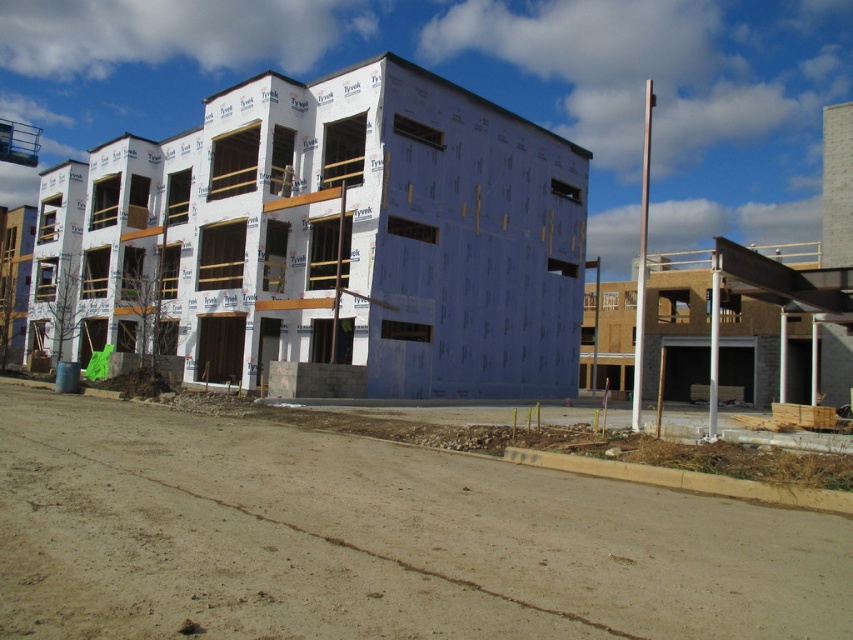
Question: Where is brown dirt track at lower center located in relation to white/textured siding building at center in the image?

Choices:
 (A) below
 (B) above

Answer: (A)

Question: Which point appears closest to the camera in this image?

Choices:
 (A) (279, 481)
 (B) (198, 211)

Answer: (A)

Question: Can you confirm if brown dirt track at lower center is positioned to the left of white/textured siding building at center?

Choices:
 (A) yes
 (B) no

Answer: (B)

Question: Can you confirm if brown dirt track at lower center is positioned to the right of white/textured siding building at center?

Choices:
 (A) yes
 (B) no

Answer: (A)

Question: Which point is farther to the camera?

Choices:
 (A) brown dirt track at lower center
 (B) white/textured siding building at center

Answer: (B)